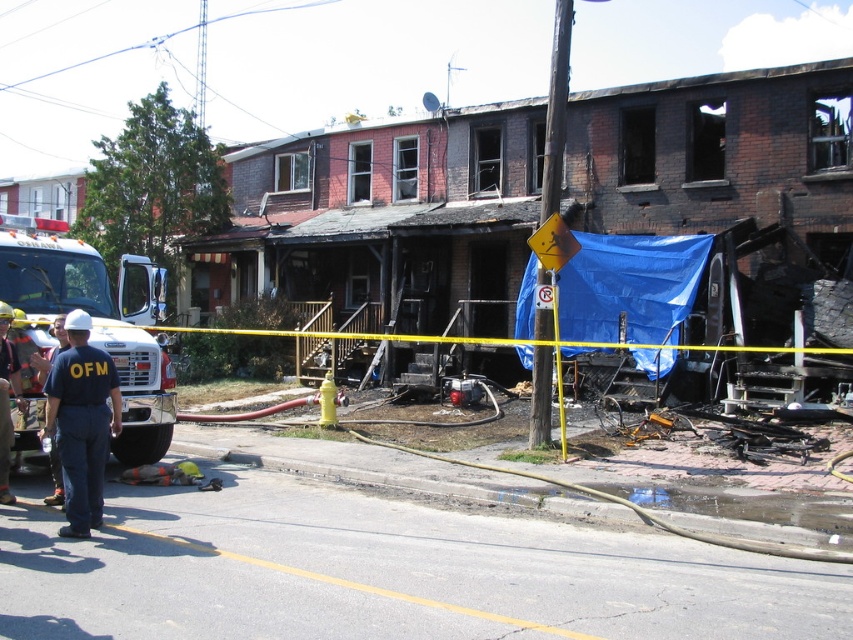
You are a firefighter arriving at the scene of a fire. You need to quickly assess the situation. Which object, the white glossy fire truck at left or the blue uniform at center, is positioned closer to the damaged building?

The white glossy fire truck at left is positioned closer to the damaged building because it is to the left of the blue uniform at center, and the damaged building is in the foreground.

You are a firefighter trying to park your white glossy fire truck at left in a narrow alleyway. The alley is only as wide as the blue uniform at center. Will your fire truck fit?

The white glossy fire truck at left might be wider than blue uniform at center, so it might not fit in the alleyway.